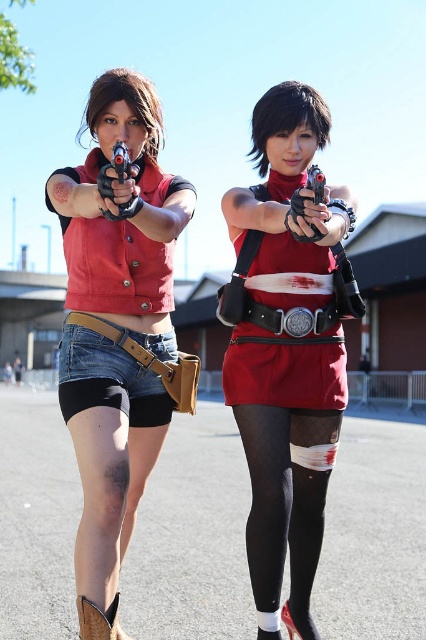
Question: Which of the following is the farthest from the observer?

Choices:
 (A) matte black toy gun at center
 (B) black plastic toy gun at upper center
 (C) denim shorts at lower left

Answer: (C)

Question: Which object is closer to the camera taking this photo?

Choices:
 (A) black mesh tights at lower center
 (B) matte black vest at center
 (C) matte red vest at center

Answer: (B)

Question: Which object appears closest to the camera in this image?

Choices:
 (A) matte black vest at center
 (B) matte red vest at center

Answer: (A)

Question: Does matte red vest at center come in front of black plastic toy gun at upper center?

Choices:
 (A) no
 (B) yes

Answer: (A)

Question: Considering the relative positions of matte red vest at center and black mesh tights at lower center in the image provided, where is matte red vest at center located with respect to black mesh tights at lower center?

Choices:
 (A) left
 (B) right

Answer: (A)

Question: Is matte red vest at center to the right of denim shorts at lower left from the viewer's perspective?

Choices:
 (A) yes
 (B) no

Answer: (A)